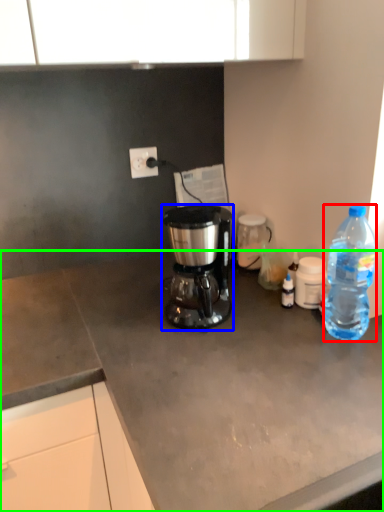
Question: Estimate the real-world distances between objects in this image. Which object is farther from bottle (highlighted by a red box), coffee maker (highlighted by a blue box) or desk (highlighted by a green box)?

Choices:
 (A) coffee maker
 (B) desk

Answer: (B)